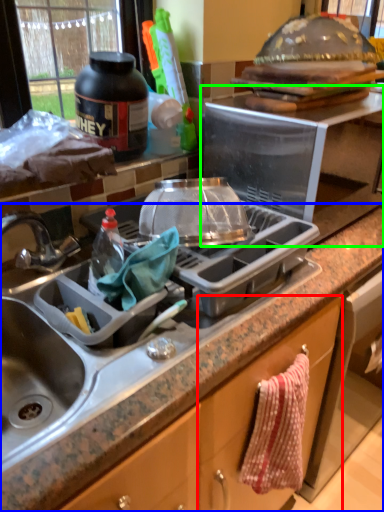
Question: Considering the real-world distances, which object is closest to cabinetry (highlighted by a red box)? countertop (highlighted by a blue box) or appliance (highlighted by a green box).

Choices:
 (A) countertop
 (B) appliance

Answer: (A)